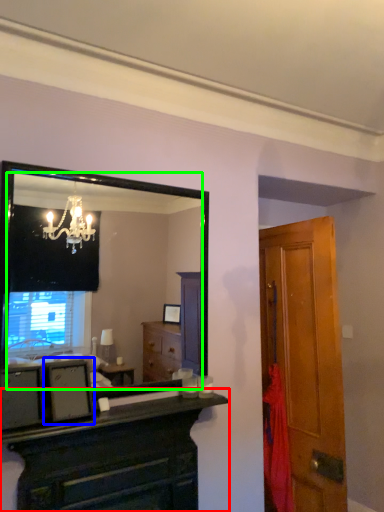
Question: Considering the real-world distances, which object is closest to chest of drawers (highlighted by a red box)? picture frame (highlighted by a blue box) or mirror (highlighted by a green box).

Choices:
 (A) picture frame
 (B) mirror

Answer: (A)